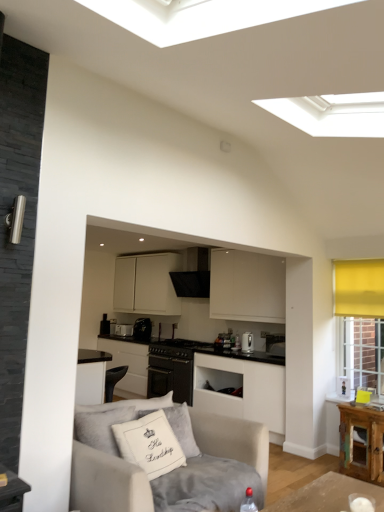
Question: In terms of width, does satin black toaster at center, which is the fourth appliance from right to left, look wider or thinner when compared to black matte stove at center, the second appliance when ordered from front to back?

Choices:
 (A) thin
 (B) wide

Answer: (A)

Question: Is satin black toaster at center, which is the fourth appliance from right to left, in front of or behind black matte stove at center, the second appliance when ordered from front to back, in the image?

Choices:
 (A) behind
 (B) front

Answer: (A)

Question: Which is farther from the satin black toaster at center, which is the fourth appliance from right to left?

Choices:
 (A) black plastic coffee maker at center, which appears as the 3th appliance when viewed from the right
 (B) black matte oven at center, the first cabinetry when ordered from bottom to top
 (C) satin silver kettle at center, the 1th appliance when ordered from front to back
 (D) white matte cabinet at center, which is the 2th cabinetry in bottom-to-top order
 (E) black textured exhaust hood at center

Answer: (C)

Question: Which object is positioned farthest from the black matte oven at center, which is the 3th cabinetry from top to bottom?

Choices:
 (A) black plastic coffee maker at center, placed as the 3th appliance when sorted from front to back
 (B) white matte cabinet at center, which is the 3th cabinetry in bottom-to-top order
 (C) light gray fabric couch at lower left
 (D) black leather armchair at lower center
 (E) black matte stove at center, arranged as the 2th appliance when viewed from the right

Answer: (C)